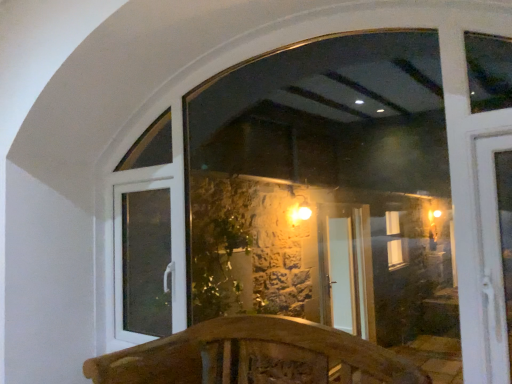
Question: Should I look upward or downward to see white plastic door at lower left?

Choices:
 (A) down
 (B) up

Answer: (A)

Question: Can you confirm if transparent glass window at center is bigger than white plastic door at lower left?

Choices:
 (A) no
 (B) yes

Answer: (B)

Question: Is transparent glass window at center taller than white plastic door at lower left?

Choices:
 (A) yes
 (B) no

Answer: (A)

Question: From a real-world perspective, is transparent glass window at center on white plastic door at lower left?

Choices:
 (A) no
 (B) yes

Answer: (B)

Question: From the image's perspective, is transparent glass window at center on white plastic door at lower left?

Choices:
 (A) yes
 (B) no

Answer: (A)

Question: Does transparent glass window at center have a greater width compared to white plastic door at lower left?

Choices:
 (A) no
 (B) yes

Answer: (A)

Question: Considering the relative positions of transparent glass window at center and white plastic door at lower left in the image provided, is transparent glass window at center behind white plastic door at lower left?

Choices:
 (A) yes
 (B) no

Answer: (B)

Question: Is white plastic door at lower left thinner than wooden carved bench at center?

Choices:
 (A) no
 (B) yes

Answer: (B)

Question: Is white plastic door at lower left bigger than wooden carved bench at center?

Choices:
 (A) yes
 (B) no

Answer: (B)

Question: Can you confirm if white plastic door at lower left is smaller than wooden carved bench at center?

Choices:
 (A) no
 (B) yes

Answer: (B)

Question: From a real-world perspective, does white plastic door at lower left stand above wooden carved bench at center?

Choices:
 (A) yes
 (B) no

Answer: (A)

Question: From the image's perspective, does white plastic door at lower left appear higher than wooden carved bench at center?

Choices:
 (A) no
 (B) yes

Answer: (B)

Question: Would you say wooden carved bench at center is part of white plastic door at lower left's contents?

Choices:
 (A) no
 (B) yes

Answer: (A)

Question: Is transparent glass window at center directly adjacent to wooden carved bench at center?

Choices:
 (A) no
 (B) yes

Answer: (A)